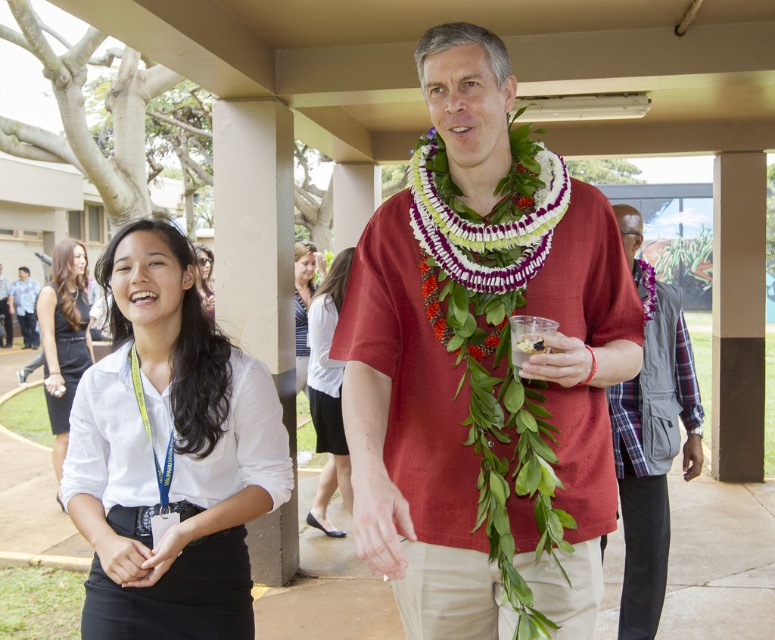
You are a photographer at the event and need to capture both the matte red shirt at center and the white cotton blouse at center in a single shot. Since the camera has a limited depth of field, which item should you focus on to ensure both are in focus?

The matte red shirt at center is positioned over the white cotton blouse at center, so focusing on the matte red shirt at center will ensure both are in focus as they are layered closely.

You are organizing a photo shoot and need to know which object takes up more area in the image. Which one is larger between the black dress at left and the matte white shirt at center?

The matte white shirt at center occupies more space than the black dress at left, so the matte white shirt at center is larger.

You are organizing a clothing donation drive and need to determine if the matte red shirt at center and the matte white blouse at center can fit side by side on a shelf that is 1.2 meters wide. Given their widths, will they fit together?

The matte red shirt at center is wider than the matte white blouse at center. However, without knowing their exact widths, it is impossible to determine if their combined width exceeds 1.2 meters. Additional measurements are needed.